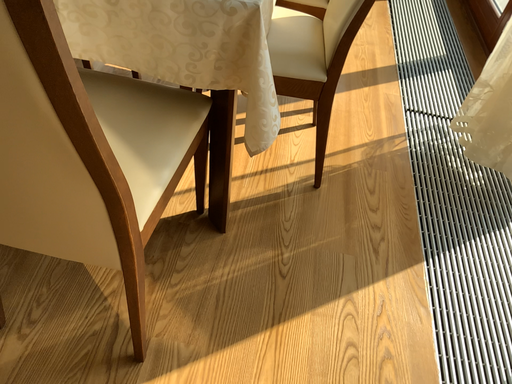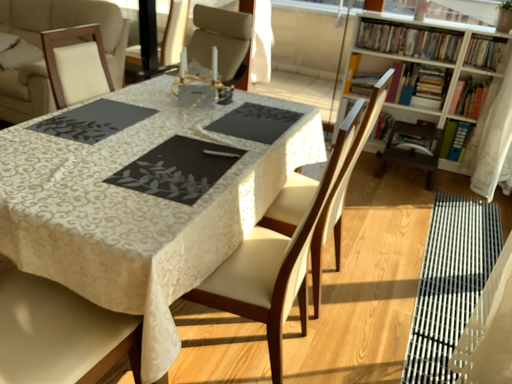
Question: How did the camera likely rotate when shooting the video?

Choices:
 (A) rotated downward
 (B) rotated upward

Answer: (B)